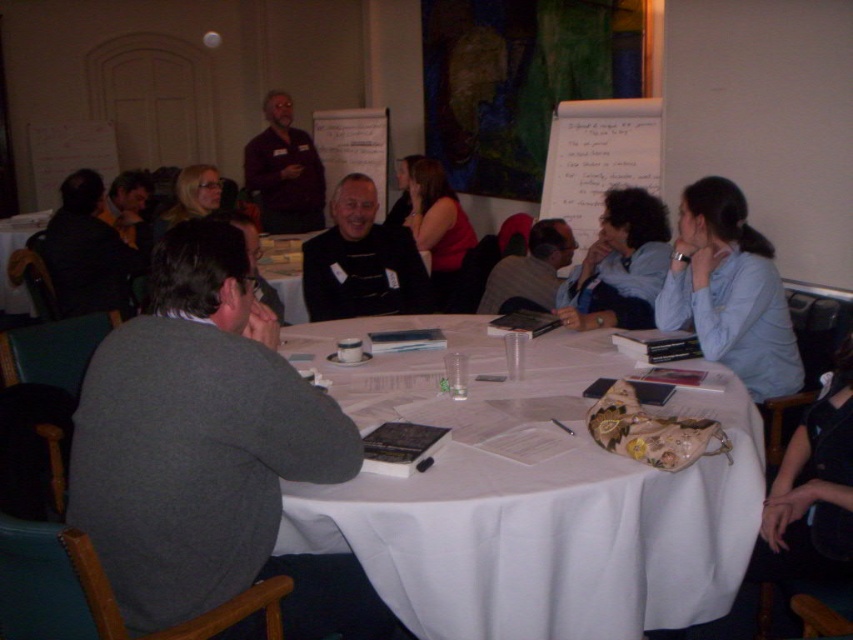
You are organizing a photo shoot and need to arrange two shirts on a mannequin. The blue fabric shirt at center and the gray sweater at center must be placed side by side. Which shirt should you place on the left to ensure the larger one is visible?

The blue fabric shirt at center should be placed on the left since it is larger than the gray sweater at center, ensuring visibility.

You are sitting at the round table in the conference room and notice two people wearing distinct clothing items. The first person is wearing a dark brown shirt at upper center, and the second is wearing a gray sweater at center. From your seated position at the table, which clothing item appears higher in the visual field?

The dark brown shirt at upper center appears higher in the visual field because it is positioned above the gray sweater at center.

You are a photographer standing behind the round table in the conference room. You want to take a group photo of the blue fabric shirt at center and the gray sweater at center. Can you fit both subjects into the frame without moving the camera? The camera has a maximum horizontal field of view of 17 inches.

The distance between the blue fabric shirt at center and the gray sweater at center is 17.59 inches. Since the camera can only capture up to 17 inches horizontally, the two subjects cannot both fit within the frame without moving the camera.